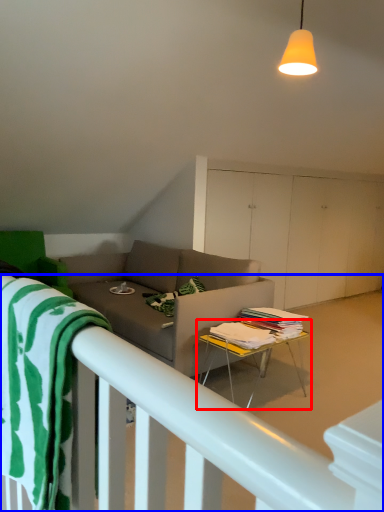
Question: Which point is closer to the camera, table (highlighted by a red box) or bed frame (highlighted by a blue box)?

Choices:
 (A) table
 (B) bed frame

Answer: (B)